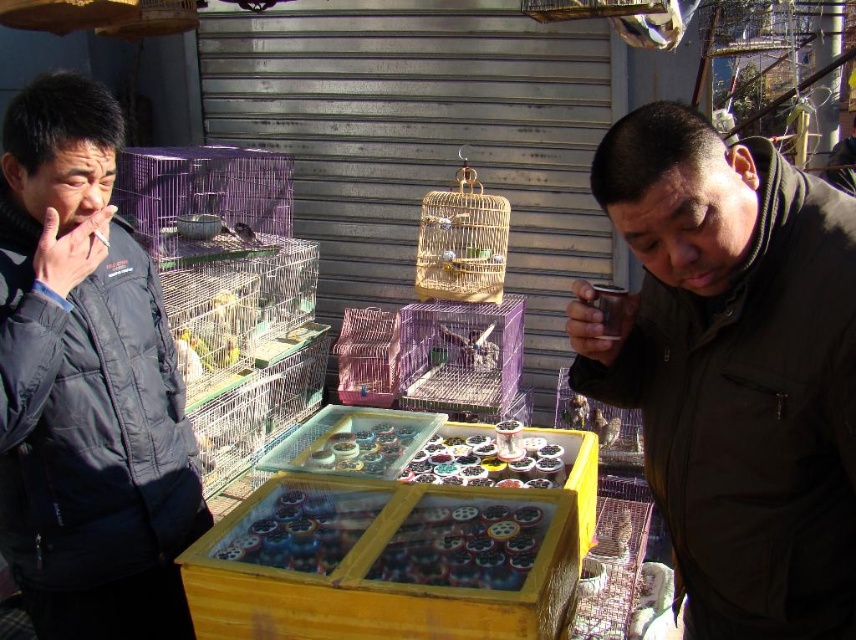
You are standing at the entrance of the market and see the dark brown jacket at center and the matte brown birdcage at center. If you want to reach both items, which one would you need to walk further to get to?

The dark brown jacket at center is 3.21 meters away from matte brown birdcage at center. Since both items are at the center, you would need to walk the same distance to reach either one, but the distance between them is 3.21 meters.

You are a customer looking to buy a jacket. You see the dark brown jacket at center and the dark gray puffy jacket at left. Which jacket is shorter in height?

The dark brown jacket at center is shorter in height compared to the dark gray puffy jacket at left.

You are a customer looking to try on jackets at a store. You see the dark brown jacket at center and the dark gray puffy jacket at left. Which jacket can you reach first without moving any other items?

The dark brown jacket at center can be reached first because it is positioned in front of the dark gray puffy jacket at left.